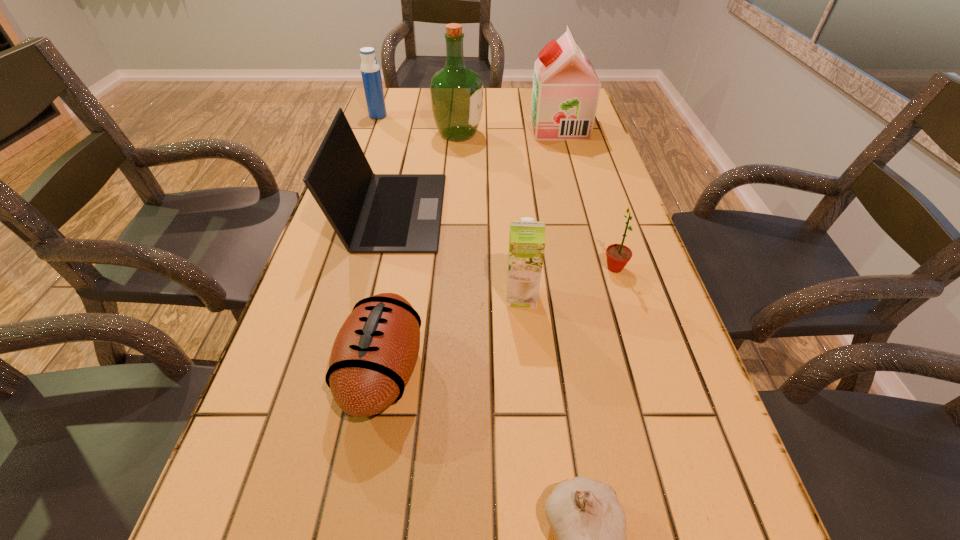
Locate an element on the screen. This screenshot has width=960, height=540. free location located 0.100m on the back of the seventh farthest object is located at coordinates (398, 285).

The image size is (960, 540). In order to click on soya milk that is at the far edge in this screenshot , I will do `click(566, 88)`.

Where is `water bottle that is at the far edge`? The width and height of the screenshot is (960, 540). water bottle that is at the far edge is located at coordinates (370, 70).

Locate an element on the screen. water bottle that is positioned at the left edge is located at coordinates (370, 70).

The image size is (960, 540). I want to click on laptop positioned at the left edge, so click(371, 213).

Where is `football (American) present at the left edge`? This screenshot has height=540, width=960. football (American) present at the left edge is located at coordinates (374, 354).

You are a GUI agent. You are given a task and a screenshot of the screen. Output one action in this format:
    pyautogui.click(x=<x>, y=<y>)
    Task: Click on the soya milk that is at the right edge
    
    Given the screenshot: What is the action you would take?
    pyautogui.click(x=566, y=88)

Identify the location of sunflower at the right edge. (618, 255).

This screenshot has width=960, height=540. What are the coordinates of `object at the far left corner` in the screenshot? It's located at (370, 70).

I want to click on object situated at the far right corner, so click(x=566, y=88).